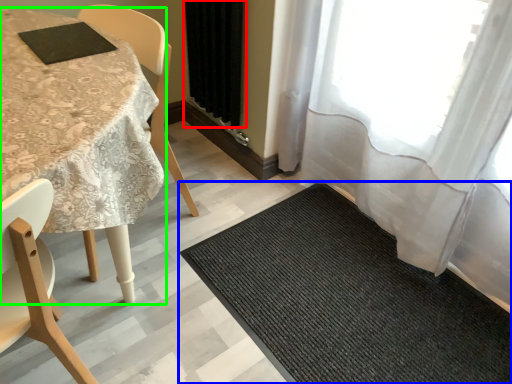
Question: Which object is positioned farthest from curtain (highlighted by a red box)? Select from mat (highlighted by a blue box) and table (highlighted by a green box).

Choices:
 (A) mat
 (B) table

Answer: (A)